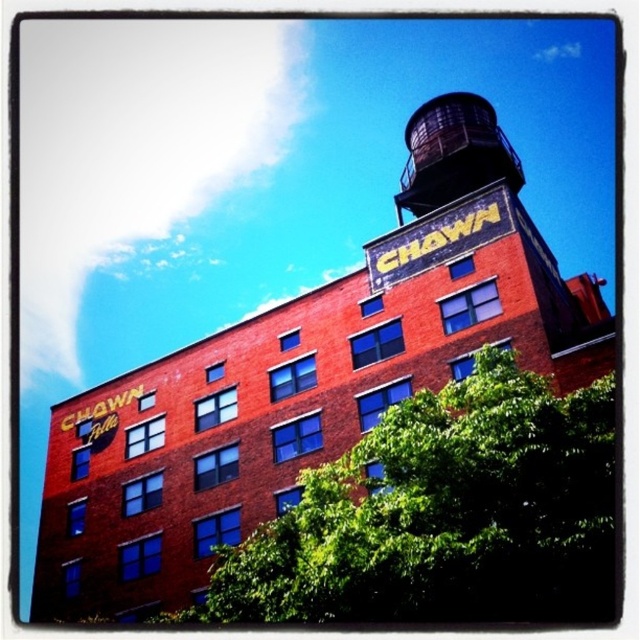
Is green leafy tree at lower center bigger than dark brown metal water tower at upper center?

No.

Which is in front, point (403, 460) or point (483, 172)?

Point (403, 460) is more forward.

This screenshot has width=640, height=640. What do you see at coordinates (444, 513) in the screenshot?
I see `green leafy tree at lower center` at bounding box center [444, 513].

The height and width of the screenshot is (640, 640). Identify the location of green leafy tree at lower center. (444, 513).